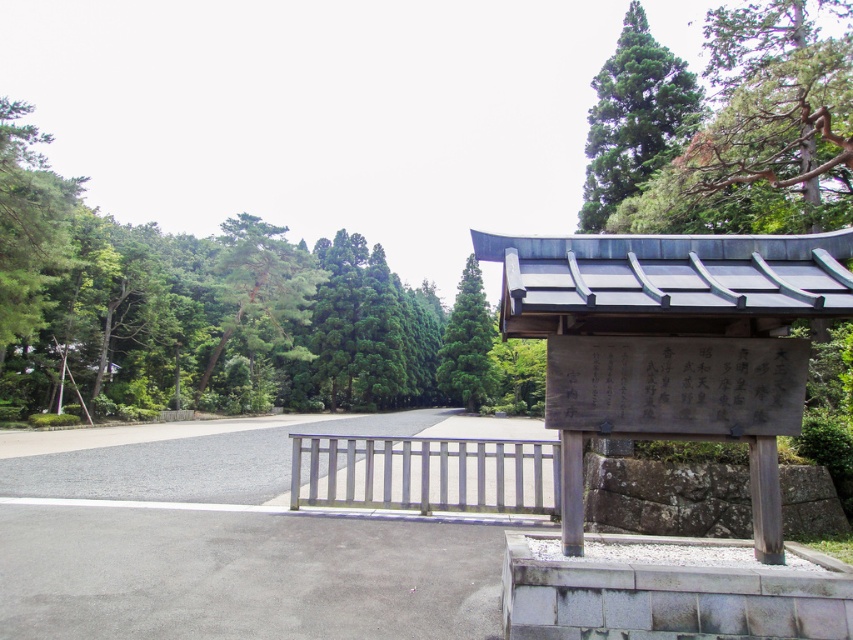
You are a gardener who wants to plant a new tree in the center of the paved area. However, there is already a white stone plaque at center and a green matte tree at center. Based on their positions, can you plant the new tree directly in the center without moving either existing object?

The white stone plaque at center is positioned over the green matte tree at center, so planting a new tree directly in the center would require moving both objects since they already occupy that space.

You are a landscape architect designing a walking path between the white painted wood rail at center and the green coniferous tree at upper center. The path must be straight and 1 meter wide. Can the path be placed directly between them without any obstacles?

The white painted wood rail at center and the green coniferous tree at upper center are 12.73 meters apart from each other. Since the path only needs to be 1 meter wide, there is sufficient space to place it directly between them without any obstacles.